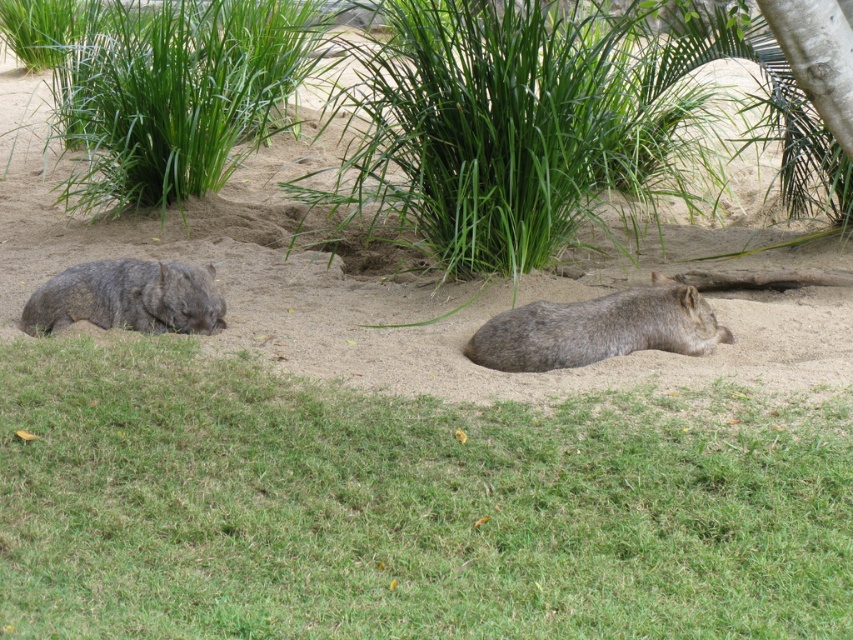
Who is more distant from viewer, (641, 312) or (136, 326)?

The point (136, 326) is behind.

Between brown furry wombat at center and gray furry wombat at left, which one has more height?

With more height is brown furry wombat at center.

Locate an element on the screen. brown furry wombat at center is located at coordinates (598, 328).

The height and width of the screenshot is (640, 853). Identify the location of brown furry wombat at center. (598, 328).

Does green leafy grass at upper left have a greater height compared to gray furry wombat at left?

Correct, green leafy grass at upper left is much taller as gray furry wombat at left.

Does green leafy grass at upper left appear over gray furry wombat at left?

Yes.

Image resolution: width=853 pixels, height=640 pixels. Identify the location of green leafy grass at upper left. (164, 88).

The width and height of the screenshot is (853, 640). What are the coordinates of `green leafy grass at upper left` in the screenshot? It's located at (164, 88).

Between green leafy grass at upper center and green leafy grass at upper left, which one has more height?

green leafy grass at upper left is taller.

Between point (486, 172) and point (146, 134), which one is positioned behind?

Point (146, 134)

Is point (372, 168) in front of point (167, 118)?

Yes, it is.

Locate an element on the screen. Image resolution: width=853 pixels, height=640 pixels. green leafy grass at upper center is located at coordinates (524, 120).